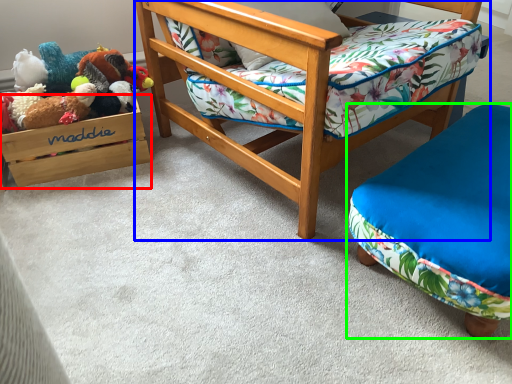
Question: Which object is the farthest from storage box (highlighted by a red box)? Choose among these: chair (highlighted by a blue box) or furniture (highlighted by a green box).

Choices:
 (A) chair
 (B) furniture

Answer: (B)